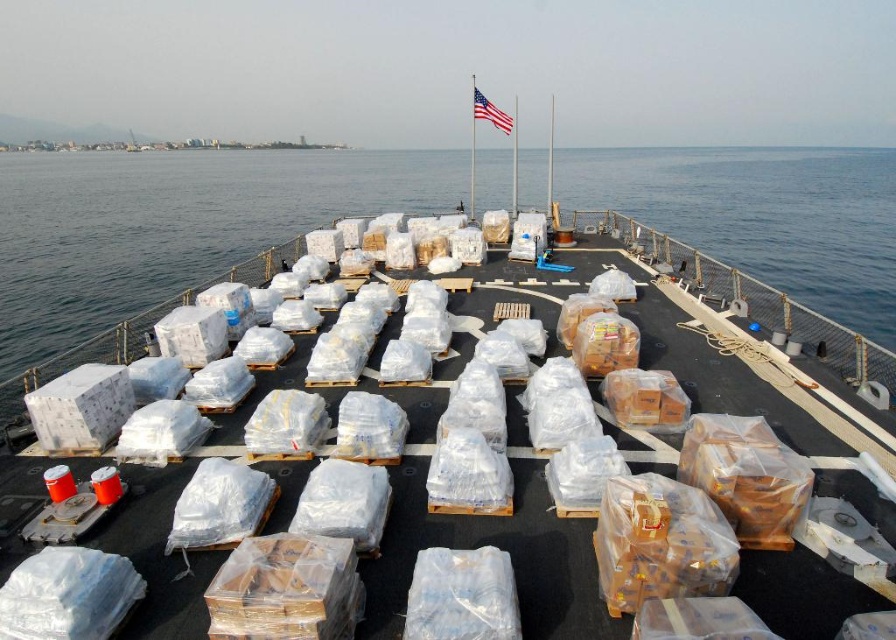
Question: Is clear plastic packages at center above transparent plastic pallets at center?

Choices:
 (A) yes
 (B) no

Answer: (B)

Question: Which object appears closest to the camera in this image?

Choices:
 (A) clear plastic packages at center
 (B) transparent plastic pallets at center
 (C) american flag at center

Answer: (A)

Question: In this image, where is clear plastic packages at center located relative to transparent plastic pallets at center?

Choices:
 (A) left
 (B) right

Answer: (B)

Question: Estimate the real-world distances between objects in this image. Which object is farther from the transparent plastic pallets at center?

Choices:
 (A) american flag at center
 (B) clear plastic packages at center

Answer: (B)

Question: Can you confirm if clear plastic packages at center is bigger than american flag at center?

Choices:
 (A) yes
 (B) no

Answer: (B)

Question: Which point appears closest to the camera in this image?

Choices:
 (A) (888, 180)
 (B) (490, 108)

Answer: (B)